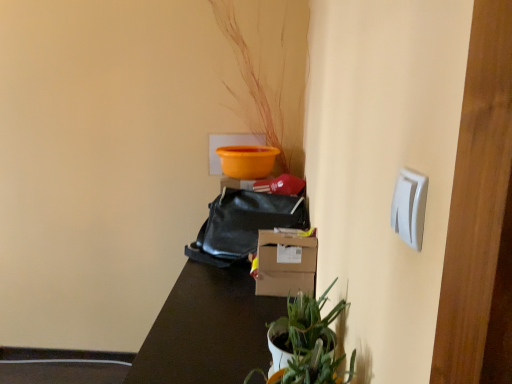
Question: Is green matte plant at lower center to the left or to the right of brown matte table at center in the image?

Choices:
 (A) left
 (B) right

Answer: (B)

Question: Is point (292, 367) positioned closer to the camera than point (144, 374)?

Choices:
 (A) closer
 (B) farther

Answer: (A)

Question: Which object is positioned closest to the brown matte table at center?

Choices:
 (A) white plastic light switch at upper right
 (B) green matte plant at lower center
 (C) black leather bag at center

Answer: (C)

Question: Considering the real-world distances, which object is farthest from the white plastic light switch at upper right?

Choices:
 (A) green matte plant at lower center
 (B) black leather bag at center
 (C) brown matte table at center

Answer: (B)